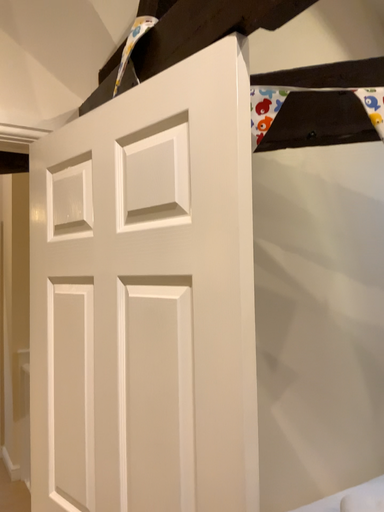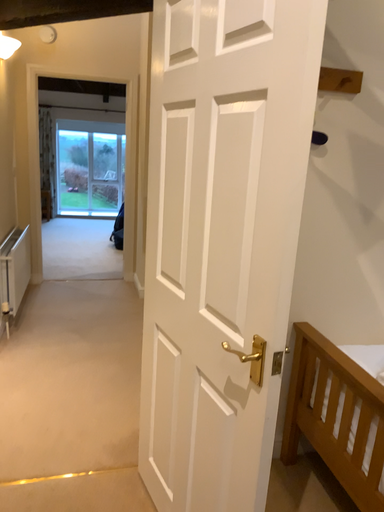
Question: Which way did the camera rotate in the video?

Choices:
 (A) rotated left
 (B) rotated right

Answer: (A)